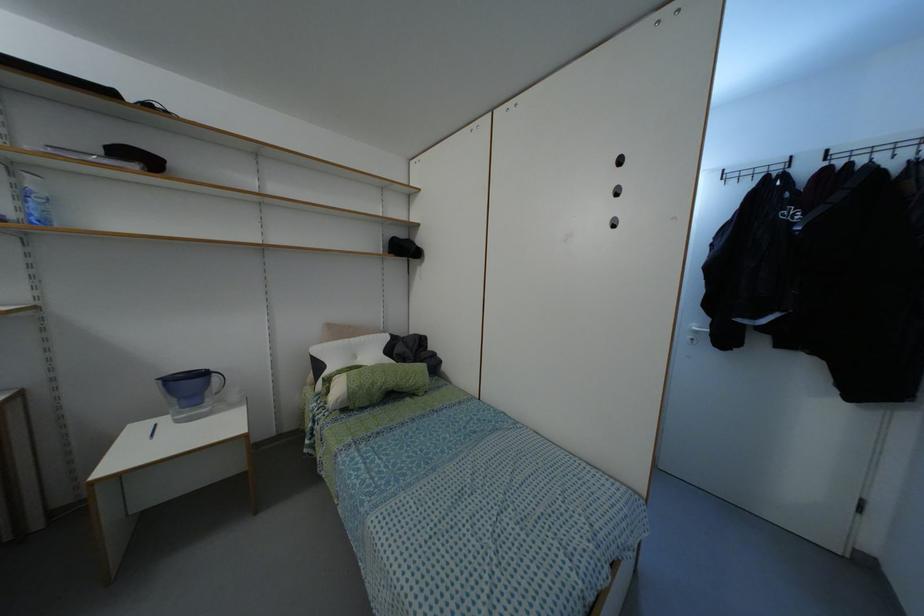
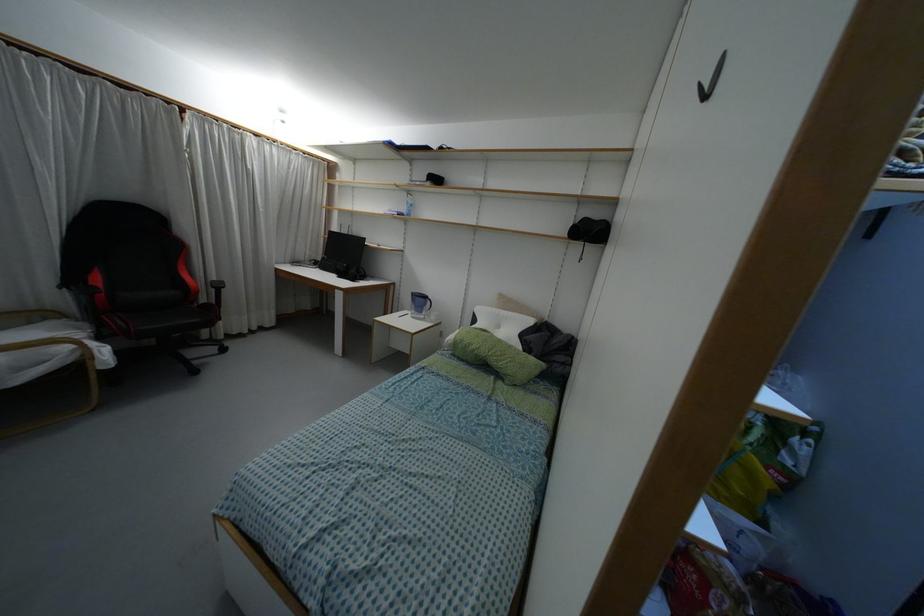
The point at (345, 339) is marked in the first image. Where is the corresponding point in the second image?

(496, 310)